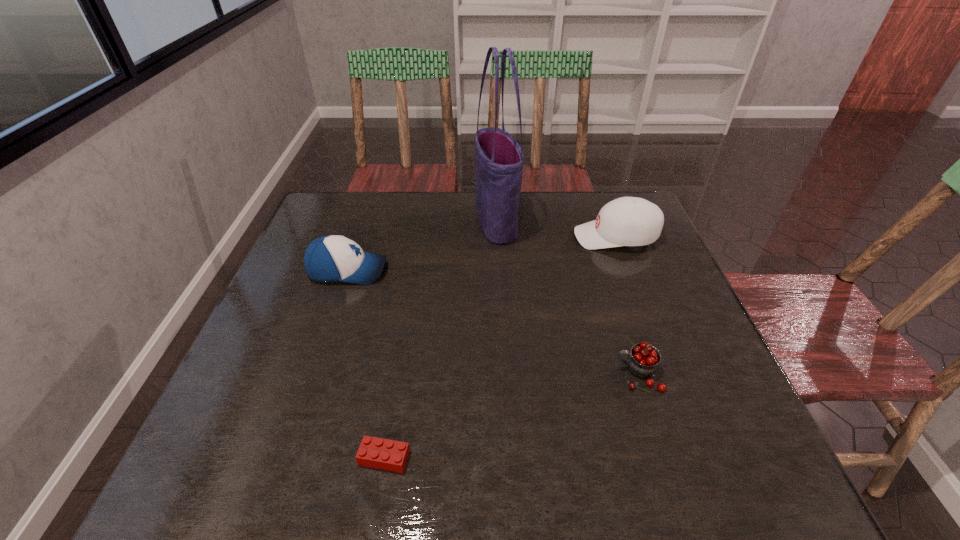
Image resolution: width=960 pixels, height=540 pixels. Find the location of `vacant space situated on the front-facing side of the right baseball cap`. vacant space situated on the front-facing side of the right baseball cap is located at coordinates (476, 237).

In order to click on vacant space located 0.360m on the front-facing side of the right baseball cap in this screenshot , I will do `click(448, 237)`.

Locate an element on the screen. The height and width of the screenshot is (540, 960). free space located on the front-facing side of the third farthest object is located at coordinates (441, 271).

I want to click on vacant space located on the handle side of the cherry, so click(x=486, y=374).

Locate an element on the screen. Image resolution: width=960 pixels, height=540 pixels. free space located 0.400m on the handle side of the cherry is located at coordinates (423, 374).

Identify the location of vacant space located 0.300m on the handle side of the cherry. This screenshot has height=540, width=960. (471, 374).

Identify the location of free space located on the back of the nearest object. (410, 302).

This screenshot has height=540, width=960. I want to click on tote bag that is at the far edge, so click(499, 159).

The image size is (960, 540). In order to click on baseball cap that is at the far edge in this screenshot , I will do `click(627, 221)`.

Locate an element on the screen. object present at the near edge is located at coordinates (374, 452).